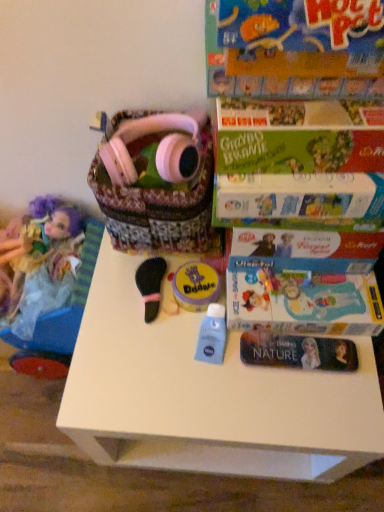
The height and width of the screenshot is (512, 384). I want to click on vacant space to the right of blue matte lotion at center, so click(x=301, y=376).